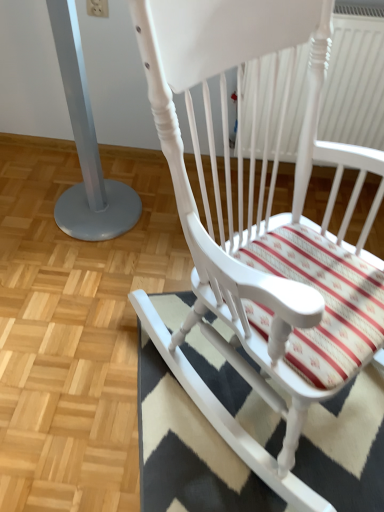
Question: Is point (251, 114) closer or farther from the camera than point (162, 44)?

Choices:
 (A) closer
 (B) farther

Answer: (B)

Question: In the image, is white plastic radiator at upper right positioned in front of or behind white painted wood rocking chair at center?

Choices:
 (A) behind
 (B) front

Answer: (A)

Question: Which is farther from the silver metallic pole at left?

Choices:
 (A) black-and-white striped rug at lower right
 (B) white painted wood rocking chair at center
 (C) white plastic radiator at upper right

Answer: (C)

Question: Based on their relative distances, which object is nearer to the silver metallic pole at left?

Choices:
 (A) black-and-white striped rug at lower right
 (B) white plastic radiator at upper right
 (C) white painted wood rocking chair at center

Answer: (C)